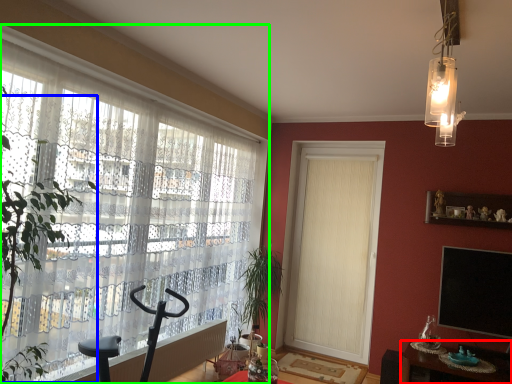
Question: Which object is positioned farthest from table (highlighted by a red box)? Select from tree (highlighted by a blue box) and curtain (highlighted by a green box).

Choices:
 (A) tree
 (B) curtain

Answer: (A)